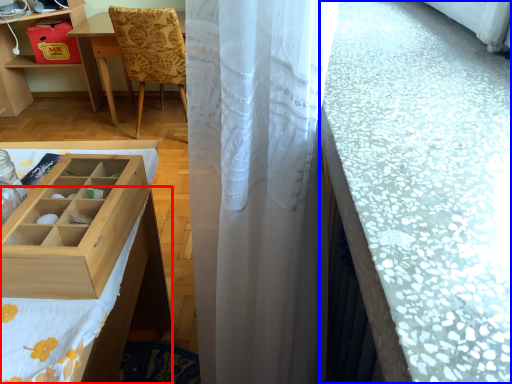
Question: Which object appears closest to the camera in this image, tablecloth (highlighted by a red box) or counter top (highlighted by a blue box)?

Choices:
 (A) tablecloth
 (B) counter top

Answer: (B)